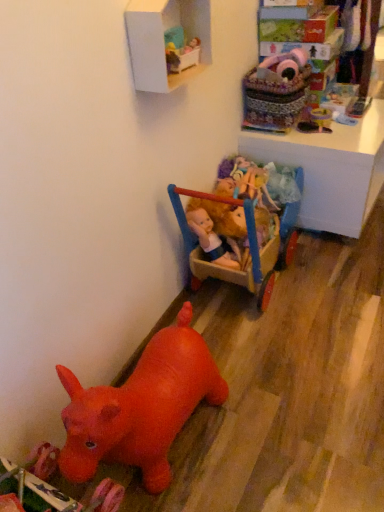
Question: From the image's perspective, is rubber red hippo at lower left, arranged as the 2th toy when ordered from the bottom, located above wooden doll carriage at upper right?

Choices:
 (A) no
 (B) yes

Answer: (A)

Question: Can you confirm if rubber red hippo at lower left, placed as the 4th toy when sorted from top to bottom, is wider than wooden doll carriage at upper right?

Choices:
 (A) no
 (B) yes

Answer: (A)

Question: Is rubber red hippo at lower left, arranged as the 2th toy when ordered from the bottom, located outside wooden doll carriage at upper right?

Choices:
 (A) no
 (B) yes

Answer: (B)

Question: Does rubber red hippo at lower left, arranged as the 2th toy when ordered from the bottom, have a greater height compared to wooden doll carriage at upper right?

Choices:
 (A) yes
 (B) no

Answer: (A)

Question: Would you consider rubber red hippo at lower left, placed as the 4th toy when sorted from top to bottom, to be distant from wooden doll carriage at upper right?

Choices:
 (A) yes
 (B) no

Answer: (A)

Question: Does rubber red hippo at lower left, arranged as the 2th toy when ordered from the bottom, have a smaller size compared to wooden doll carriage at upper right?

Choices:
 (A) no
 (B) yes

Answer: (B)

Question: Considering the relative sizes of rubber red horse at lower left, which ranks as the 5th toy in top-to-bottom order, and rubber red hippo at lower left, arranged as the 2th toy when ordered from the bottom, in the image provided, is rubber red horse at lower left, which ranks as the 5th toy in top-to-bottom order, bigger than rubber red hippo at lower left, arranged as the 2th toy when ordered from the bottom,?

Choices:
 (A) no
 (B) yes

Answer: (A)

Question: Is rubber red horse at lower left, acting as the 1th toy starting from the bottom, at the right side of rubber red hippo at lower left, arranged as the 2th toy when ordered from the bottom?

Choices:
 (A) yes
 (B) no

Answer: (B)

Question: Is rubber red horse at lower left, acting as the 1th toy starting from the bottom, facing towards rubber red hippo at lower left, arranged as the 2th toy when ordered from the bottom?

Choices:
 (A) no
 (B) yes

Answer: (A)

Question: Is rubber red horse at lower left, acting as the 1th toy starting from the bottom, wider than rubber red hippo at lower left, placed as the 4th toy when sorted from top to bottom?

Choices:
 (A) no
 (B) yes

Answer: (B)

Question: Is rubber red horse at lower left, acting as the 1th toy starting from the bottom, at the left side of rubber red hippo at lower left, placed as the 4th toy when sorted from top to bottom?

Choices:
 (A) no
 (B) yes

Answer: (B)

Question: Is rubber red horse at lower left, acting as the 1th toy starting from the bottom, positioned with its back to rubber red hippo at lower left, placed as the 4th toy when sorted from top to bottom?

Choices:
 (A) no
 (B) yes

Answer: (A)

Question: Is white matte shelf at upper center to the right of velvet pink plush at upper right, which is the fourth toy from bottom to top, from the viewer's perspective?

Choices:
 (A) no
 (B) yes

Answer: (A)